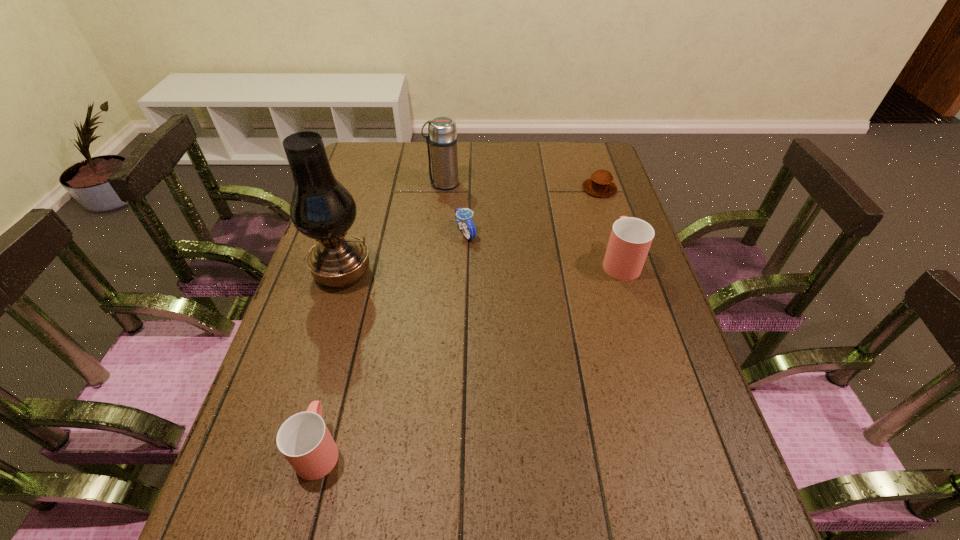
This screenshot has height=540, width=960. I want to click on free region that satisfies the following two spatial constraints: 1. on the side of the nearest object with the handle; 2. on the right side of the watch, so click(374, 233).